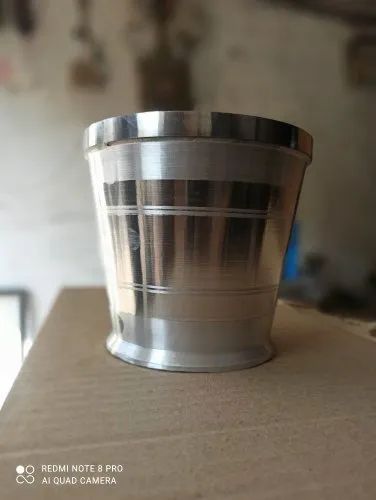
This screenshot has width=376, height=500. Identify the location of table. (287, 423).